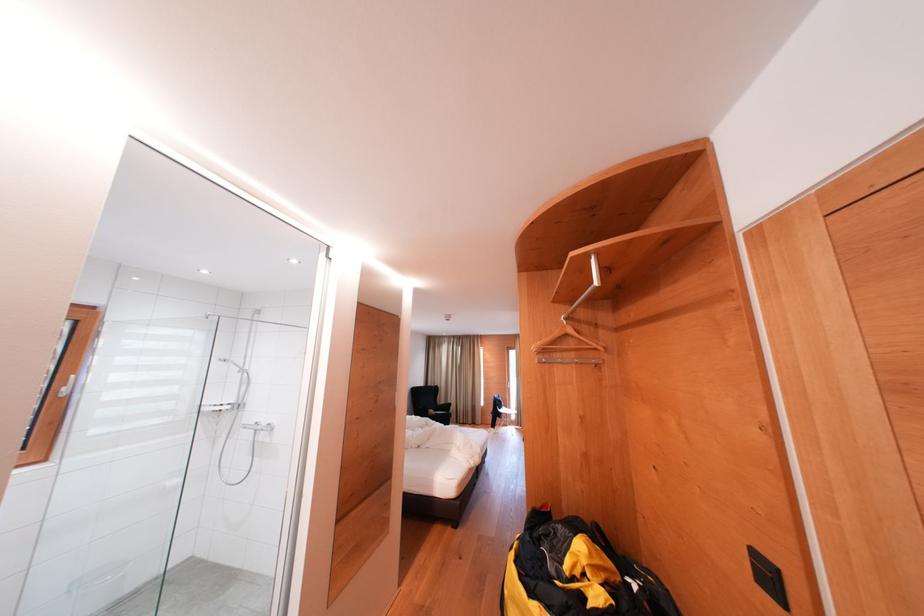
Locate an element on the screen. This screenshot has width=924, height=616. chair armrest is located at coordinates click(x=440, y=413).